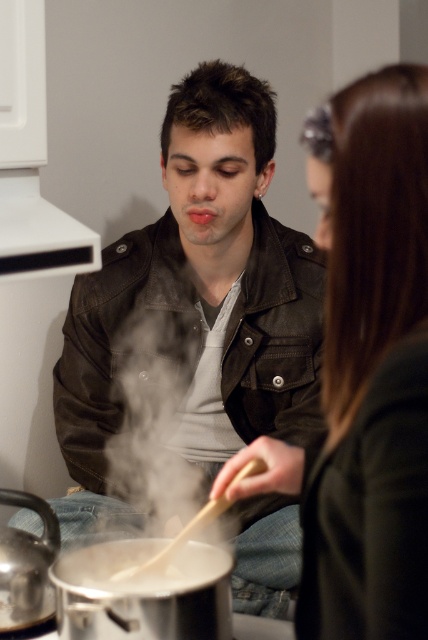
Which is in front, point (259, 563) or point (106, 589)?

Positioned in front is point (106, 589).

At what (x,y) coordinates should I click in order to perform the action: click on matte black jacket at center. Please return your answer as a coordinate pair (x, y). The width and height of the screenshot is (428, 640). Looking at the image, I should click on (199, 289).

Measure the distance between matte black jacket at center and camera.

1.30 meters

Where is `matte black jacket at center`? matte black jacket at center is located at coordinates (199, 289).

Who is shorter, matte black jacket at center or smooth brown hair at upper right?

Standing shorter between the two is smooth brown hair at upper right.

Is matte black jacket at center bigger than smooth brown hair at upper right?

Correct, matte black jacket at center is larger in size than smooth brown hair at upper right.

Which is in front, point (210, 227) or point (314, 637)?

Point (314, 637) is more forward.

The height and width of the screenshot is (640, 428). What are the coordinates of `matte black jacket at center` in the screenshot? It's located at (199, 289).

Between smooth brown hair at upper right and white matte pot at lower center, which one has less height?

With less height is white matte pot at lower center.

Is smooth brown hair at upper right taller than white matte pot at lower center?

Indeed, smooth brown hair at upper right has a greater height compared to white matte pot at lower center.

Which is behind, point (400, 520) or point (106, 556)?

Positioned behind is point (106, 556).

At what (x,y) coordinates should I click in order to perform the action: click on smooth brown hair at upper right. Please return your answer as a coordinate pair (x, y). Looking at the image, I should click on (371, 371).